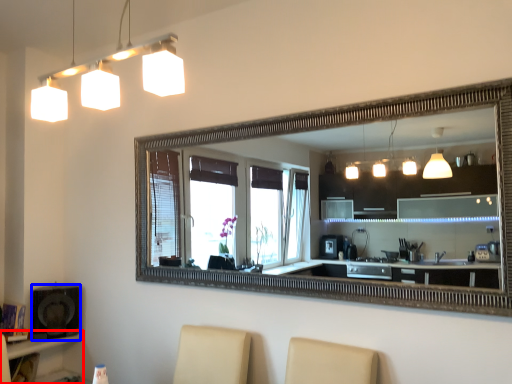
Question: Which point is further to the camera, vanity (highlighted by a red box) or speaker (highlighted by a blue box)?

Choices:
 (A) vanity
 (B) speaker

Answer: (B)